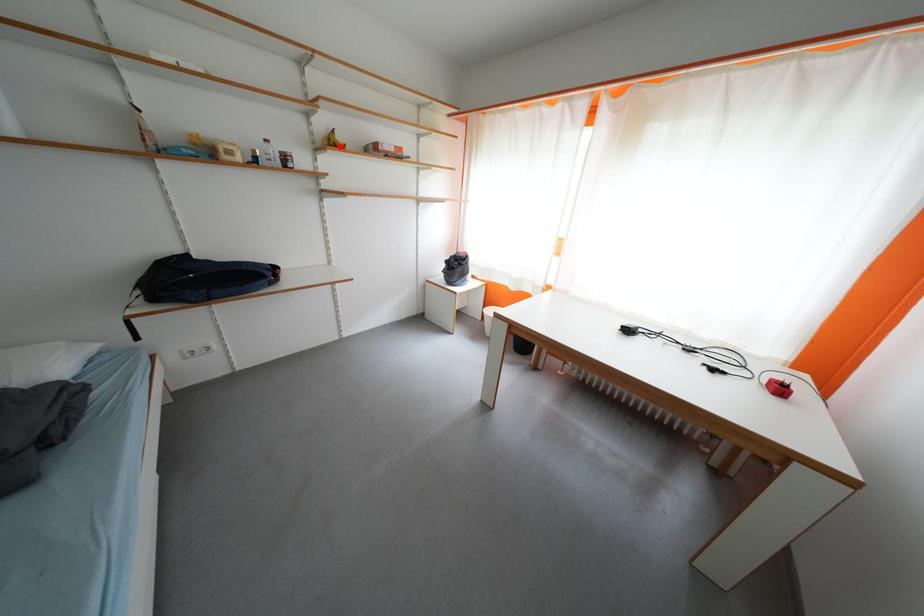
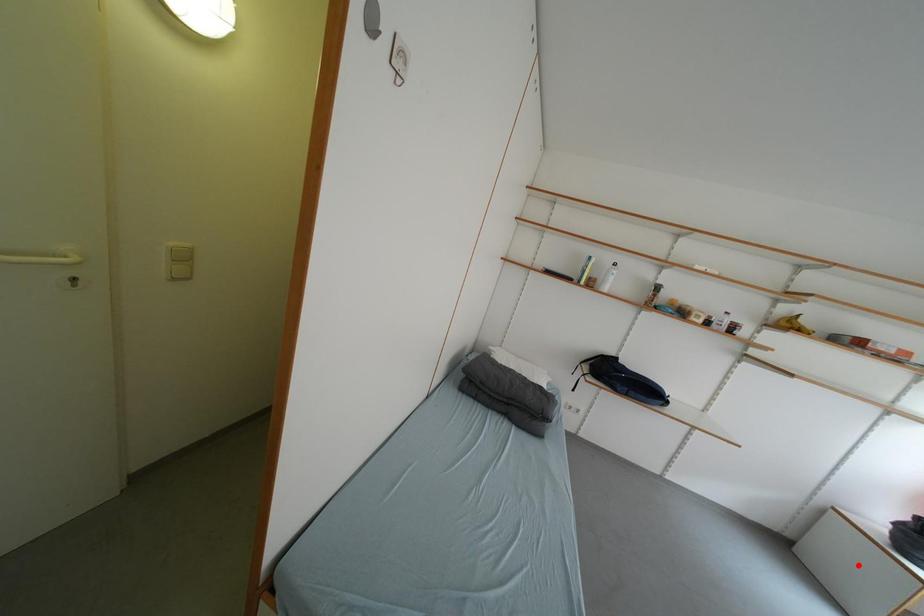
I am providing you with two images of the same scene from different viewpoints. A red point is marked on the first image and another point is marked on the second image. Is the marked point in image1 the same physical position as the marked point in image2?

No